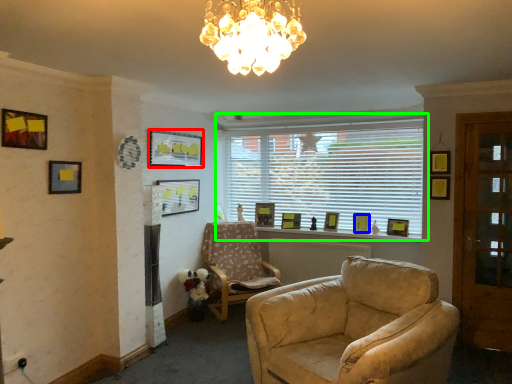
Question: Estimate the real-world distances between objects in this image. Which object is farther from picture frame (highlighted by a red box), picture frame (highlighted by a blue box) or window (highlighted by a green box)?

Choices:
 (A) picture frame
 (B) window

Answer: (A)